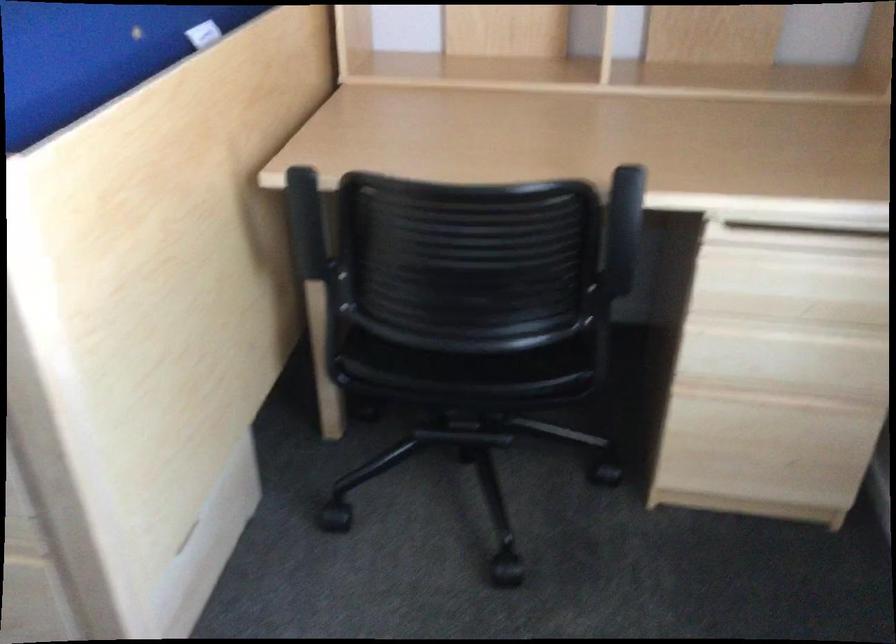
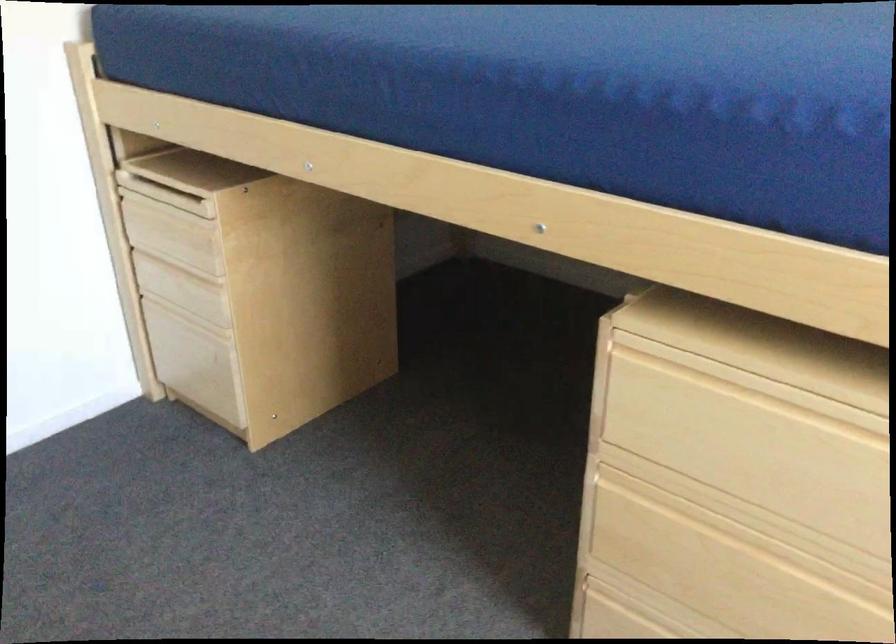
Question: The images are taken continuously from a first-person perspective. In which direction is your viewpoint rotating?

Choices:
 (A) Left
 (B) Right
 (C) Up
 (D) Down

Answer: (A)